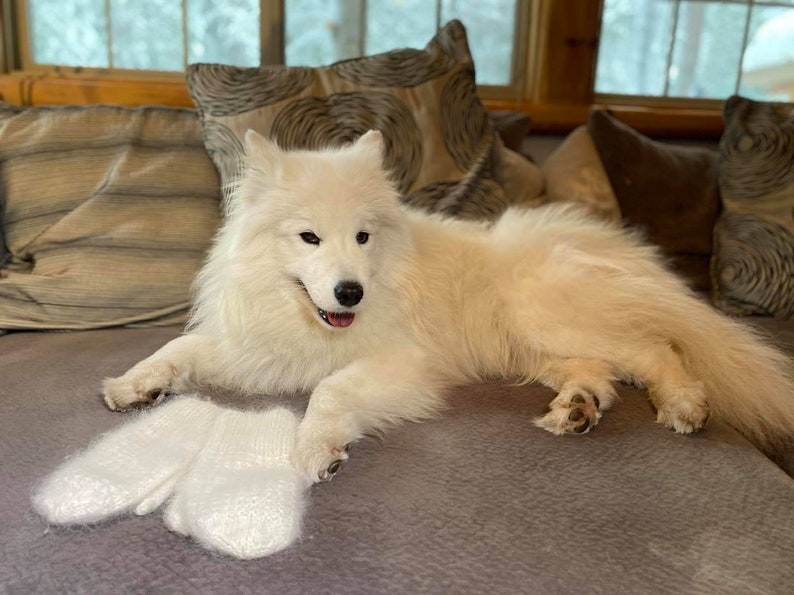
This screenshot has width=794, height=595. In order to click on bedspread in this screenshot , I will do `click(407, 537)`.